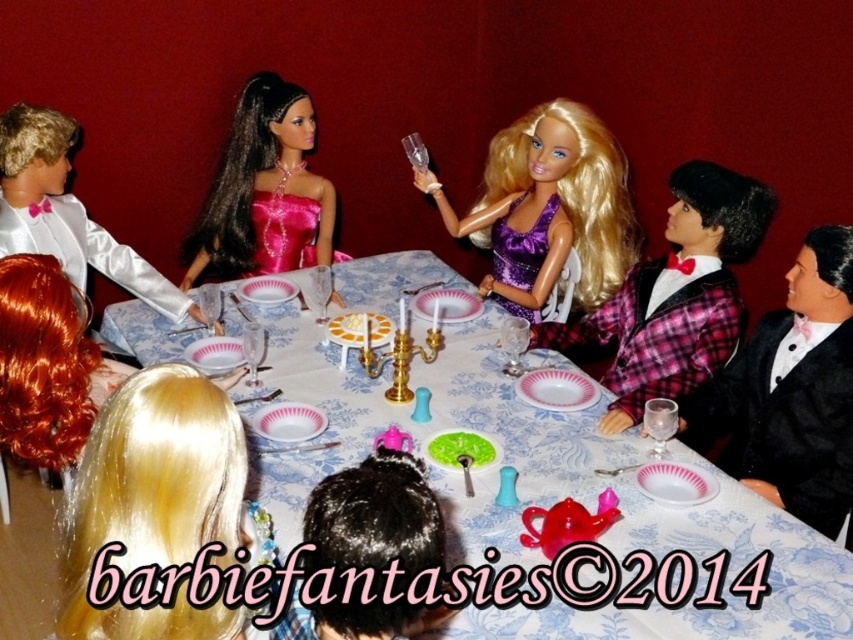
Is purple satin dress at upper center taller than shiny orange wig at lower left?

Yes, purple satin dress at upper center is taller than shiny orange wig at lower left.

Who is higher up, purple satin dress at upper center or shiny orange wig at lower left?

Positioned higher is purple satin dress at upper center.

Is point (566, 234) closer to viewer compared to point (102, 365)?

No, (566, 234) is behind (102, 365).

Where is `purple satin dress at upper center`? Image resolution: width=853 pixels, height=640 pixels. purple satin dress at upper center is located at coordinates (548, 209).

Who is lower down, purple satin dress at upper center or white satin tuxedo at left?

white satin tuxedo at left

Describe the element at coordinates (548, 209) in the screenshot. I see `purple satin dress at upper center` at that location.

Does point (560, 250) come farther from viewer compared to point (70, 269)?

Yes, point (560, 250) is behind point (70, 269).

You are a GUI agent. You are given a task and a screenshot of the screen. Output one action in this format:
    pyautogui.click(x=<x>, y=<y>)
    Task: Click on the purple satin dress at upper center
    This screenshot has width=853, height=640.
    Given the screenshot: What is the action you would take?
    pyautogui.click(x=548, y=209)

Identify the location of blue floral tablecloth at center. (544, 490).

Is blue floral tablecloth at center smaller than shiny pink satin dress at upper left?

No, blue floral tablecloth at center is not smaller than shiny pink satin dress at upper left.

I want to click on blue floral tablecloth at center, so click(x=544, y=490).